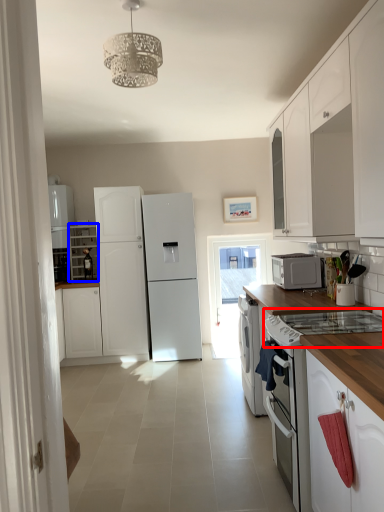
Question: Which object is further to the camera taking this photo, gas stove (highlighted by a red box) or cabinetry (highlighted by a blue box)?

Choices:
 (A) gas stove
 (B) cabinetry

Answer: (B)